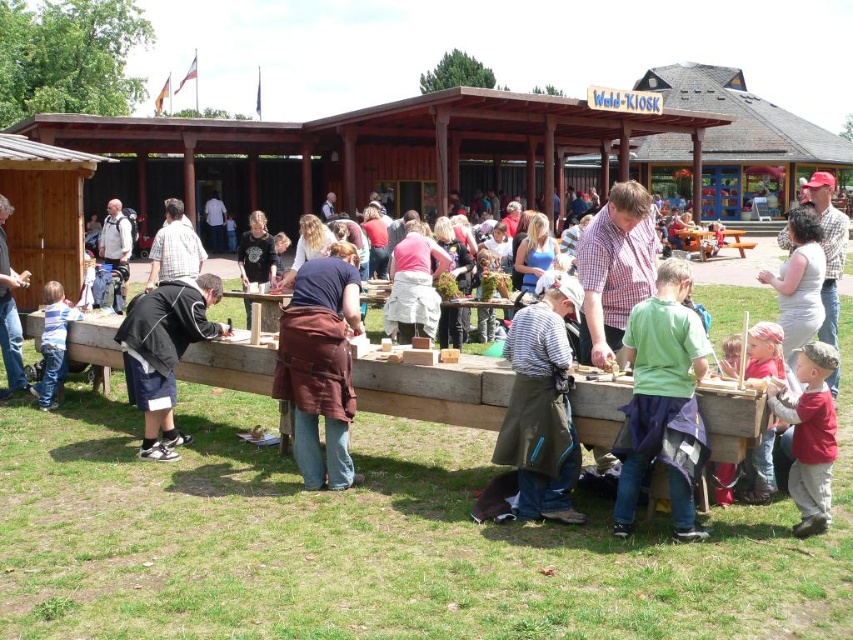
Does dark blue shirt at center appear on the right side of wooden picnic table at center?

In fact, dark blue shirt at center is to the left of wooden picnic table at center.

Is dark blue shirt at center above wooden picnic table at center?

No.

Between point (248, 214) and point (708, 234), which one is positioned in front?

Point (708, 234) is more forward.

The height and width of the screenshot is (640, 853). Identify the location of dark blue shirt at center. (256, 253).

Is wooden table at center to the right of striped cotton shirt at lower left from the viewer's perspective?

Yes, wooden table at center is to the right of striped cotton shirt at lower left.

Which is more to the left, wooden table at center or striped cotton shirt at lower left?

striped cotton shirt at lower left is more to the left.

Is point (628, 384) more distant than point (39, 384)?

No, it is not.

Identify the location of wooden table at center. (434, 388).

Is striped fabric apron at center positioned before wooden picnic table at center?

Yes, striped fabric apron at center is closer to the viewer.

Is point (506, 460) closer to viewer compared to point (711, 237)?

Yes, point (506, 460) is closer to viewer.

Identify the location of striped fabric apron at center. (543, 403).